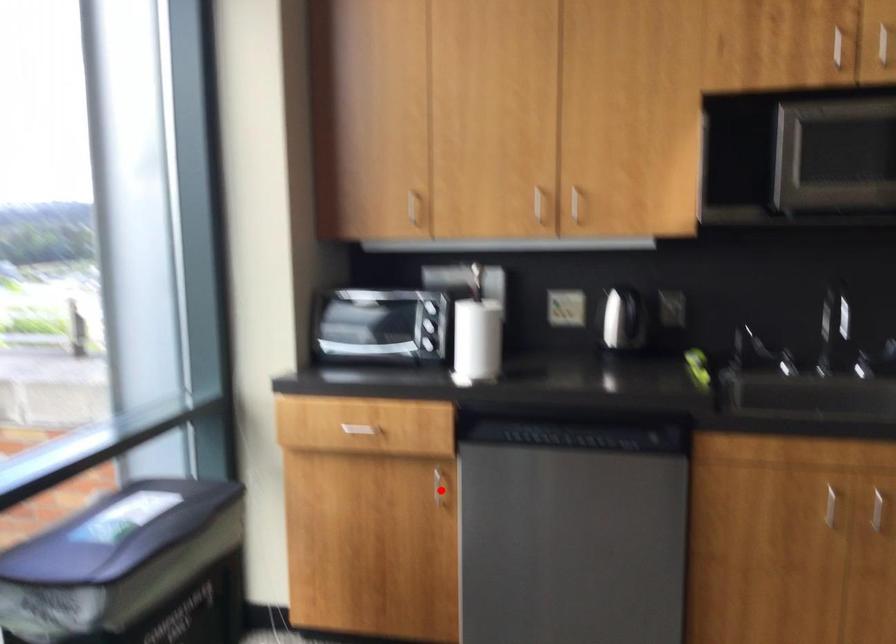
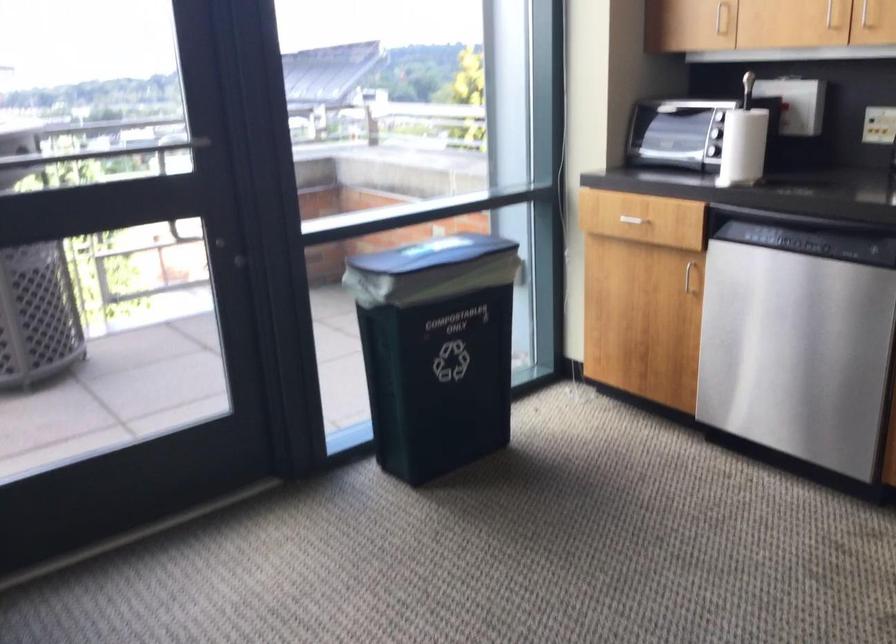
In the second image, find the point that corresponds to the highlighted location in the first image.

(690, 276)